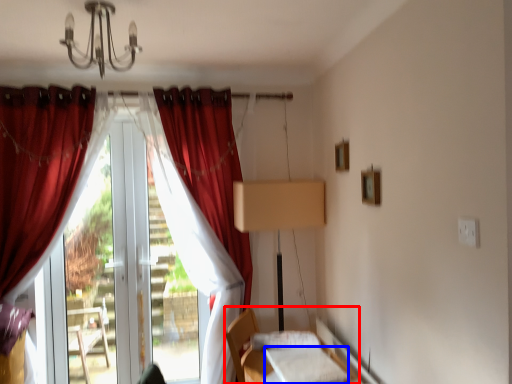
Question: Which object appears closest to the camera in this image, bed (highlighted by a red box) or sheet (highlighted by a blue box)?

Choices:
 (A) bed
 (B) sheet

Answer: (B)